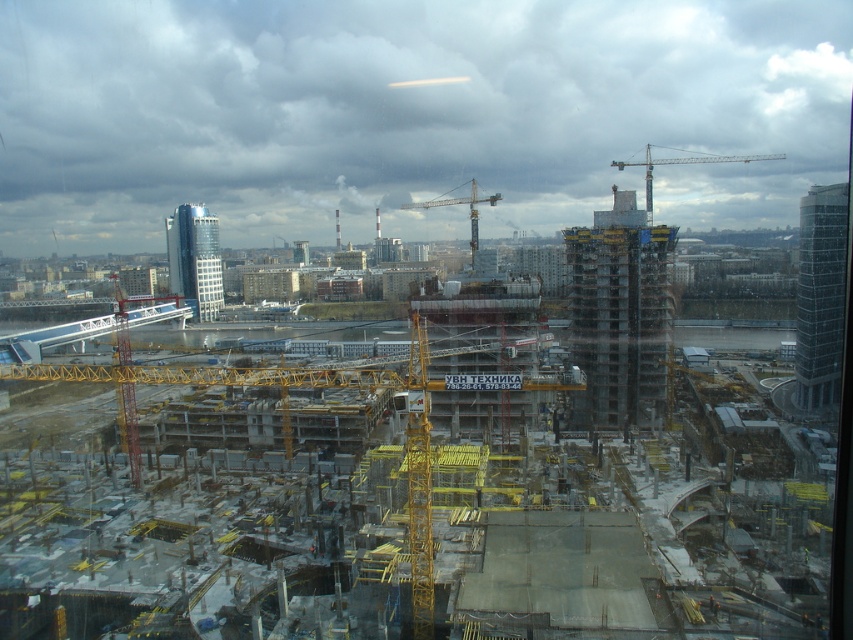
Question: Can you confirm if concrete at center is positioned above yellow metallic crane at upper center?

Choices:
 (A) yes
 (B) no

Answer: (B)

Question: Among these points, which one is farthest from the camera?

Choices:
 (A) (456, 198)
 (B) (664, 518)
 (C) (717, 160)

Answer: (A)

Question: Estimate the real-world distances between objects in this image. Which object is closer to the yellow metallic crane at upper center?

Choices:
 (A) yellow metallic crane at center
 (B) concrete at center

Answer: (B)

Question: Which object appears farthest from the camera in this image?

Choices:
 (A) concrete at center
 (B) yellow metallic crane at upper center
 (C) yellow metallic crane at center

Answer: (C)

Question: Is concrete at center above yellow metallic crane at center?

Choices:
 (A) no
 (B) yes

Answer: (A)

Question: Is yellow metallic crane at upper center closer to camera compared to yellow metallic crane at center?

Choices:
 (A) yes
 (B) no

Answer: (A)